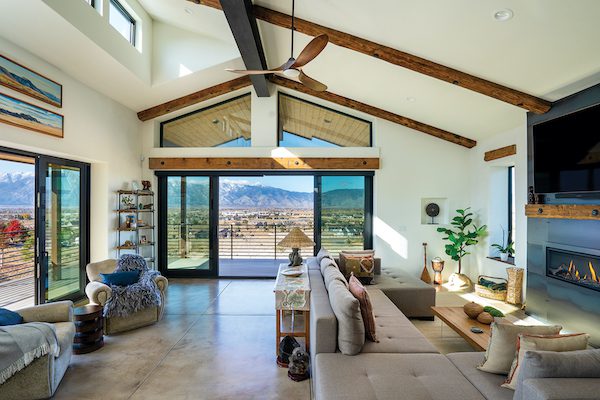
At what (x,y) coordinates should I click in order to perform the action: click on windows to the far left. Please return your answer as a coordinate pair (x, y). The width and height of the screenshot is (600, 400). Looking at the image, I should click on (13, 210), (69, 210).